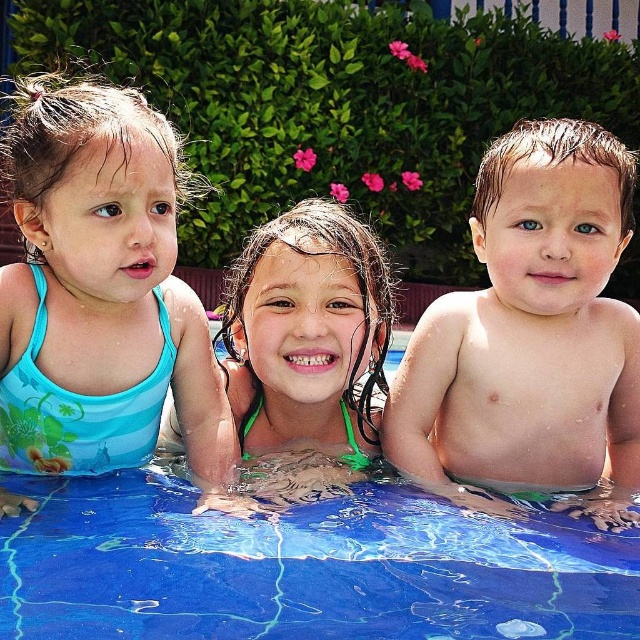
Question: Can you confirm if smooth skin baby at right is positioned above green fabric swimsuit at center?

Choices:
 (A) no
 (B) yes

Answer: (B)

Question: Does smooth skin baby at right have a larger size compared to green fabric swimsuit at center?

Choices:
 (A) yes
 (B) no

Answer: (B)

Question: Does smooth skin baby at right have a larger size compared to green fabric swimsuit at center?

Choices:
 (A) yes
 (B) no

Answer: (B)

Question: Which point is farther to the camera?

Choices:
 (A) (134, 502)
 (B) (326, 449)
 (C) (388, 396)

Answer: (B)

Question: Estimate the real-world distances between objects in this image. Which object is closer to the blue printed swimsuit at left?

Choices:
 (A) blue glossy water at center
 (B) smooth skin baby at right
 (C) green fabric swimsuit at center

Answer: (C)

Question: Among these points, which one is nearest to the camera?

Choices:
 (A) (356, 264)
 (B) (499, 468)
 (C) (506, 548)

Answer: (C)